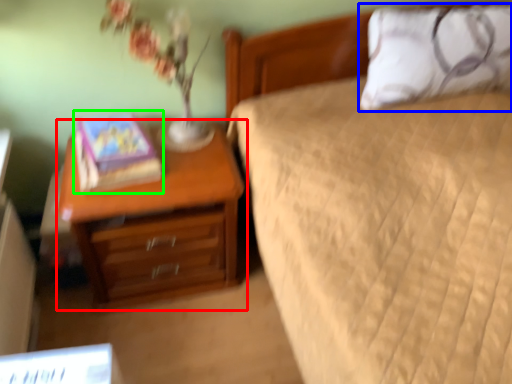
Question: Which is farther away from nightstand (highlighted by a red box)? pillow (highlighted by a blue box) or book (highlighted by a green box)?

Choices:
 (A) pillow
 (B) book

Answer: (A)